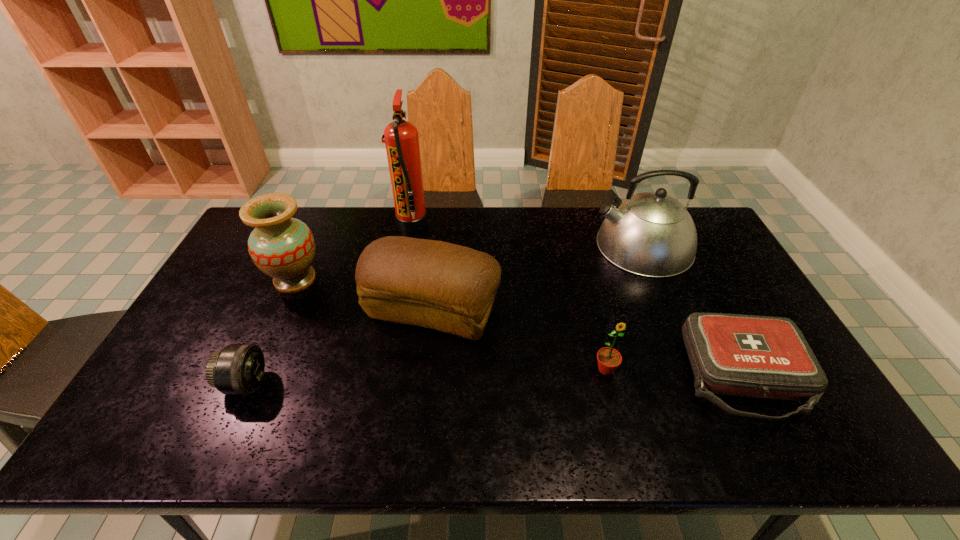
What are the coordinates of `fire extinguisher` in the screenshot? It's located at (401, 140).

The height and width of the screenshot is (540, 960). Find the location of `kettle`. kettle is located at coordinates (652, 234).

The width and height of the screenshot is (960, 540). In order to click on vase in this screenshot , I will do `click(282, 247)`.

Locate an element on the screen. the fourth tallest object is located at coordinates (438, 285).

Where is `the fifth object from left to right`? The width and height of the screenshot is (960, 540). the fifth object from left to right is located at coordinates click(x=609, y=359).

I want to click on the fifth tallest object, so [x=609, y=359].

At what (x,y) coordinates should I click in order to perform the action: click on telephoto lens. Please return your answer as a coordinate pair (x, y). The width and height of the screenshot is (960, 540). Looking at the image, I should click on (238, 369).

You are a GUI agent. You are given a task and a screenshot of the screen. Output one action in this format:
    pyautogui.click(x=<x>, y=<y>)
    Task: Click on the shortest object
    
    Given the screenshot: What is the action you would take?
    pyautogui.click(x=751, y=356)

The width and height of the screenshot is (960, 540). Find the location of `vacant space situated with the nozzle pointing from the back of the tallest object`. vacant space situated with the nozzle pointing from the back of the tallest object is located at coordinates (x=507, y=224).

At what (x,y) coordinates should I click in order to perform the action: click on free region located from the spout of the kettle. Please return your answer as a coordinate pair (x, y). Image resolution: width=960 pixels, height=540 pixels. Looking at the image, I should click on (532, 246).